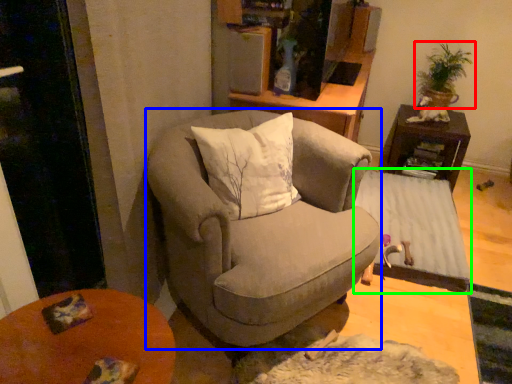
Question: Based on their relative distances, which object is farther from houseplant (highlighted by a red box)? Choose from chair (highlighted by a blue box) and table (highlighted by a green box).

Choices:
 (A) chair
 (B) table

Answer: (A)